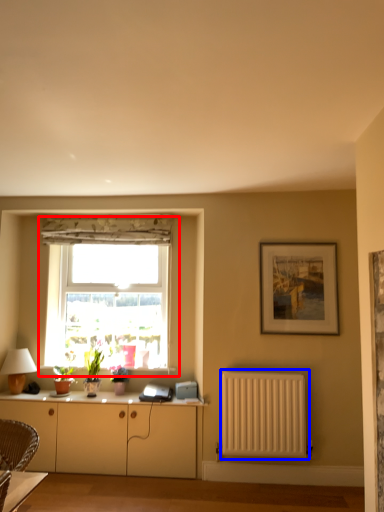
Question: Among these objects, which one is nearest to the camera, window (highlighted by a red box) or radiator (highlighted by a blue box)?

Choices:
 (A) window
 (B) radiator

Answer: (B)